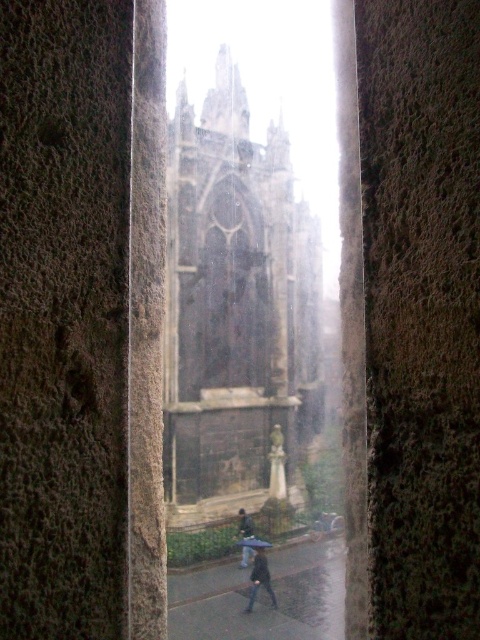
You are standing at the point marked as point (309, 381) and want to walk straight ahead. The cathedral is 362.79 feet away. If you can walk at a speed of 3 feet per second, how many seconds will it take you to reach the cathedral?

The distance to the cathedral is 362.79 feet, and your walking speed is 3 feet per second. To calculate the time, divide the distance by the speed. 362.79 divided by 3 equals approximately 120.93 seconds. So, it will take roughly 121 seconds to reach the cathedral.